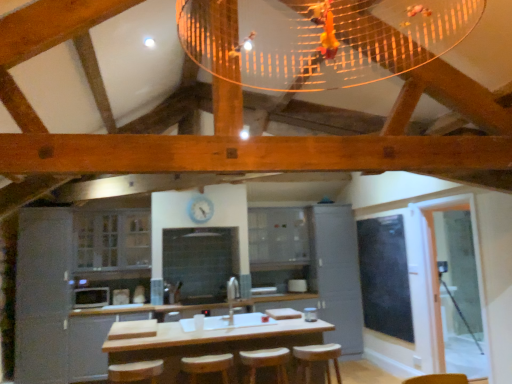
Question: Is the position of black glass window screen at right more distant than that of wooden bar stool at center, acting as the second bar stool starting from the right?

Choices:
 (A) yes
 (B) no

Answer: (A)

Question: Considering the relative sizes of black glass window screen at right and wooden bar stool at center, acting as the second bar stool starting from the right, in the image provided, is black glass window screen at right smaller than wooden bar stool at center, acting as the second bar stool starting from the right,?

Choices:
 (A) yes
 (B) no

Answer: (B)

Question: Considering the relative sizes of black glass window screen at right and wooden bar stool at center, acting as the second bar stool starting from the right, in the image provided, is black glass window screen at right thinner than wooden bar stool at center, acting as the second bar stool starting from the right,?

Choices:
 (A) no
 (B) yes

Answer: (B)

Question: From the image's perspective, is black glass window screen at right below wooden bar stool at center, acting as the second bar stool starting from the right?

Choices:
 (A) yes
 (B) no

Answer: (B)

Question: Does black glass window screen at right turn towards wooden bar stool at center, acting as the second bar stool starting from the right?

Choices:
 (A) no
 (B) yes

Answer: (A)

Question: Is black glass window screen at right next to wooden bar stool at center, the second bar stool viewed from the left?

Choices:
 (A) no
 (B) yes

Answer: (A)

Question: Considering the relative positions of clear glass cabinet at center, the third cabinetry viewed from the left, and wooden bar stool at center, acting as the second bar stool starting from the right, in the image provided, is clear glass cabinet at center, the third cabinetry viewed from the left, behind wooden bar stool at center, acting as the second bar stool starting from the right,?

Choices:
 (A) no
 (B) yes

Answer: (B)

Question: Can you confirm if clear glass cabinet at center, the third cabinetry viewed from the left, is smaller than wooden bar stool at center, acting as the second bar stool starting from the right?

Choices:
 (A) no
 (B) yes

Answer: (A)

Question: Is clear glass cabinet at center, marked as the 2th cabinetry in a right-to-left arrangement, oriented away from wooden bar stool at center, the second bar stool viewed from the left?

Choices:
 (A) yes
 (B) no

Answer: (B)

Question: From a real-world perspective, is clear glass cabinet at center, marked as the 2th cabinetry in a right-to-left arrangement, located higher than wooden bar stool at center, the second bar stool viewed from the left?

Choices:
 (A) no
 (B) yes

Answer: (B)

Question: Can you confirm if clear glass cabinet at center, marked as the 2th cabinetry in a right-to-left arrangement, is shorter than wooden bar stool at center, acting as the second bar stool starting from the right?

Choices:
 (A) yes
 (B) no

Answer: (B)

Question: Is clear glass cabinet at center, the third cabinetry viewed from the left, outside wooden bar stool at center, the second bar stool viewed from the left?

Choices:
 (A) no
 (B) yes

Answer: (B)

Question: Considering the relative sizes of black glass window screen at right and matte gray cabinet at center, arranged as the 1th cabinetry when viewed from the right, in the image provided, is black glass window screen at right shorter than matte gray cabinet at center, arranged as the 1th cabinetry when viewed from the right,?

Choices:
 (A) yes
 (B) no

Answer: (A)